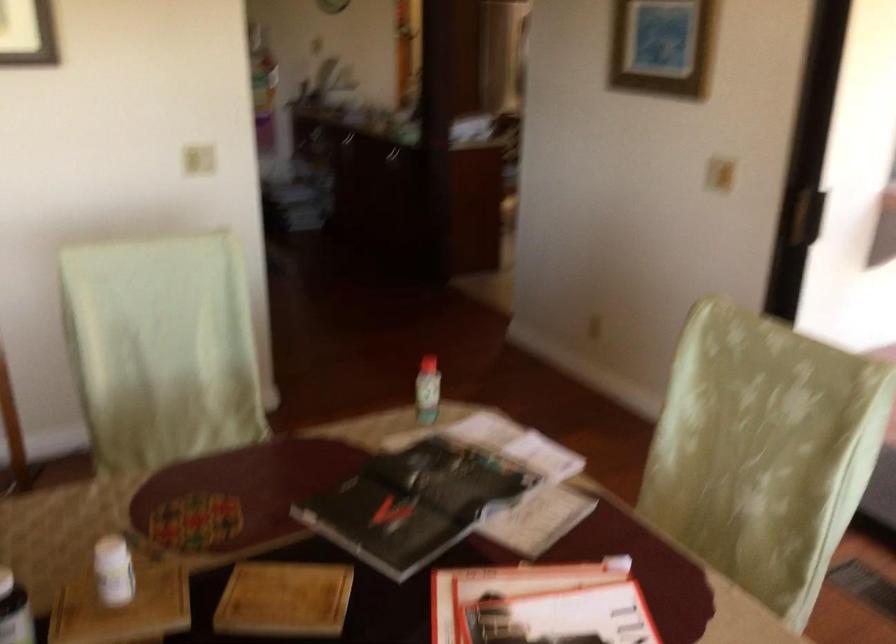
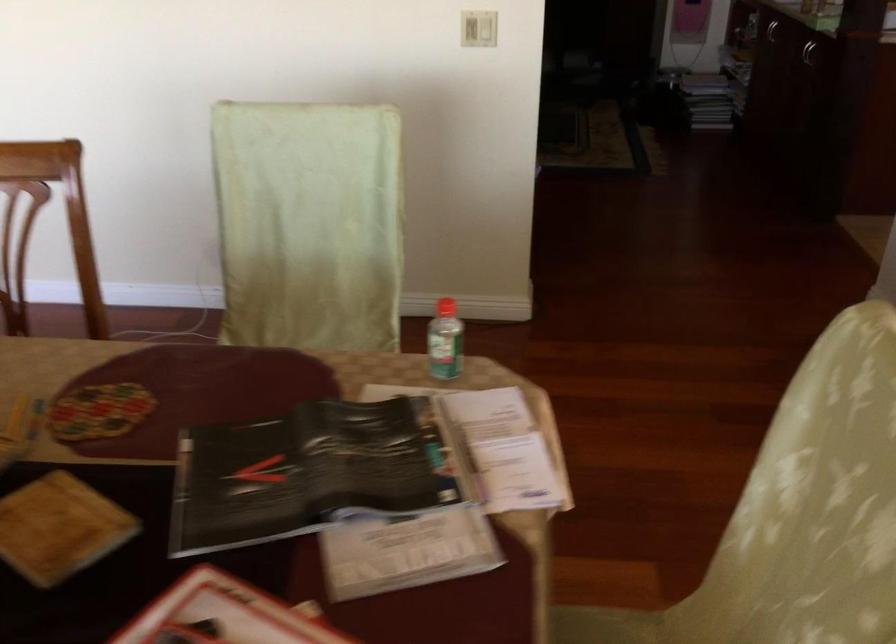
The point at (200, 156) is marked in the first image. Where is the corresponding point in the second image?

(478, 29)